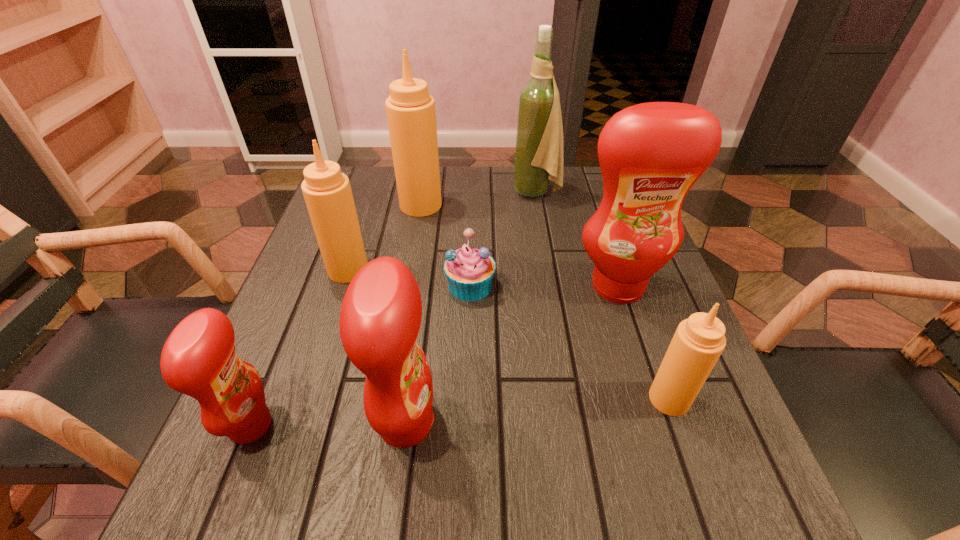
Where is `condiment that is the third closest to the leftmost red condiment`? The height and width of the screenshot is (540, 960). condiment that is the third closest to the leftmost red condiment is located at coordinates (410, 109).

The width and height of the screenshot is (960, 540). Identify the location of condiment that can be found as the third closest to the rightmost tan condiment. (327, 192).

You are a GUI agent. You are given a task and a screenshot of the screen. Output one action in this format:
    pyautogui.click(x=<x>, y=<y>)
    Task: Click on the red condiment that is the second closest to the second tan condiment from left to right
    The width and height of the screenshot is (960, 540).
    Given the screenshot: What is the action you would take?
    pyautogui.click(x=380, y=318)

Locate an element on the screen. the closest red condiment relative to the smallest red condiment is located at coordinates (380, 318).

Locate which tan condiment is the second closest to the second smallest red condiment. Please provide its 2D coordinates. Your answer should be formatted as a tuple, i.e. [(x, y)], where the tuple contains the x and y coordinates of a point satisfying the conditions above.

[(698, 342)]

Image resolution: width=960 pixels, height=540 pixels. I want to click on tan condiment that is the closest to the smallest red condiment, so click(327, 192).